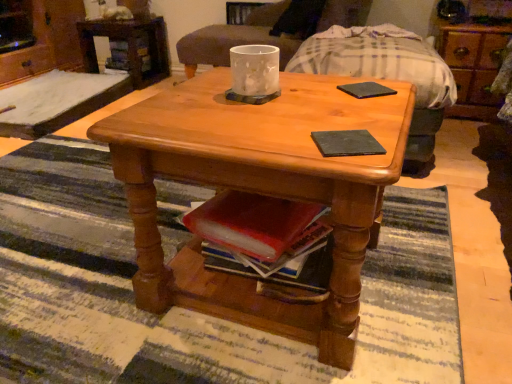
Question: Is matte glass candle at center to the left or to the right of brushed metal dresser at upper left, which appears as the 2th dresser when viewed from the right, in the image?

Choices:
 (A) right
 (B) left

Answer: (A)

Question: Considering the positions of point (205, 31) and point (72, 56), is point (205, 31) closer or farther from the camera than point (72, 56)?

Choices:
 (A) farther
 (B) closer

Answer: (B)

Question: Estimate the real-world distances between objects in this image. Which object is closer to the translucent glass candle at center?

Choices:
 (A) matte glass candle at center
 (B) wooden dresser at upper right, the first dresser in the right-to-left sequence
 (C) brushed metal dresser at upper left, acting as the first dresser starting from the left
 (D) black matte pad at center, positioned as the 1th pad in left-to-right order
 (E) black matte pad at center, marked as the first pad in a back-to-front arrangement

Answer: (E)

Question: Which of these objects is positioned closest to the wooden armchair at center?

Choices:
 (A) matte glass candle at center
 (B) wooden desk at upper left
 (C) black matte pad at center, the 2th pad positioned from the back
 (D) wooden dresser at upper right, the first dresser in the right-to-left sequence
 (E) black matte pad at center, marked as the first pad in a back-to-front arrangement

Answer: (A)